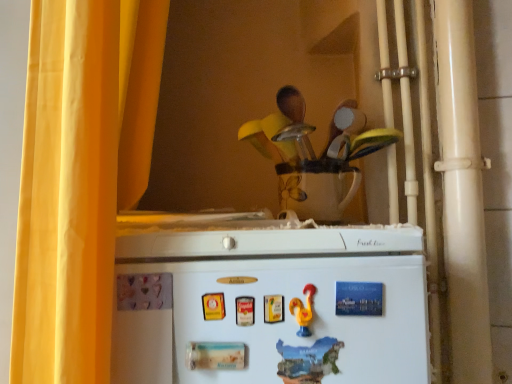
Question: Is yellow fabric curtain at left spatially inside wooden spoon set at upper center, or outside of it?

Choices:
 (A) inside
 (B) outside

Answer: (B)

Question: From the image's perspective, relative to wooden spoon set at upper center, is yellow fabric curtain at left above or below?

Choices:
 (A) above
 (B) below

Answer: (B)

Question: Based on their relative distances, which object is nearer to the yellow fabric curtain at left?

Choices:
 (A) wooden spoon set at upper center
 (B) blue paper magnet at upper center, placed as the 1th magnet when sorted from top to bottom
 (C) white matte magnet at lower center, which is counted as the 1th magnet, starting from the bottom
 (D) white matte refrigerator at lower center

Answer: (D)

Question: Which object is the closest to the wooden spoon set at upper center?

Choices:
 (A) white matte refrigerator at lower center
 (B) white matte magnet at lower center, which is counted as the 1th magnet, starting from the bottom
 (C) blue paper magnet at upper center, the second magnet from the bottom
 (D) yellow fabric curtain at left

Answer: (A)